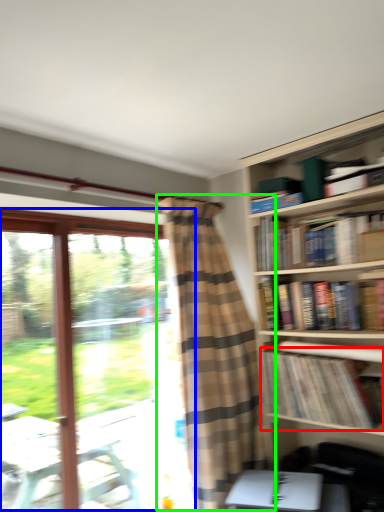
Question: Which object is the farthest from book (highlighted by a red box)? Choose among these: window (highlighted by a blue box) or curtain (highlighted by a green box).

Choices:
 (A) window
 (B) curtain

Answer: (A)